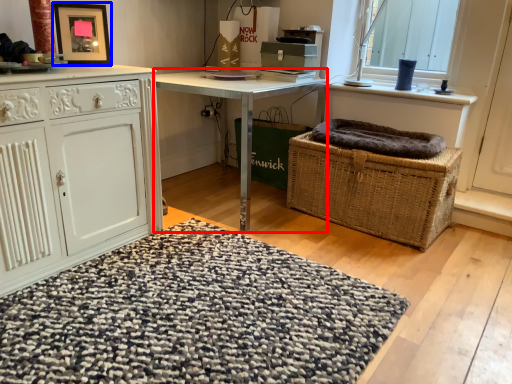
Question: Among these objects, which one is farthest to the camera, desk (highlighted by a red box) or picture frame (highlighted by a blue box)?

Choices:
 (A) desk
 (B) picture frame

Answer: (A)